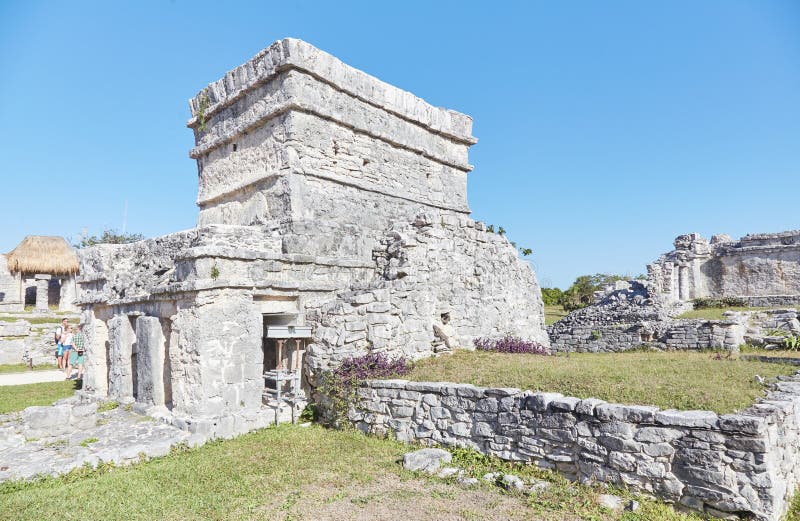
Identify the location of corner. (750, 470).